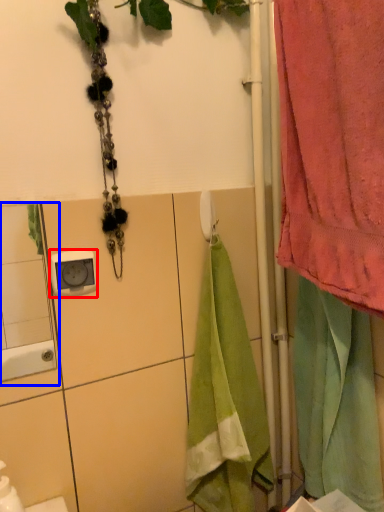
Question: Which of the following is the closest to the observer, electric outlet (highlighted by a red box) or mirror (highlighted by a blue box)?

Choices:
 (A) electric outlet
 (B) mirror

Answer: (B)